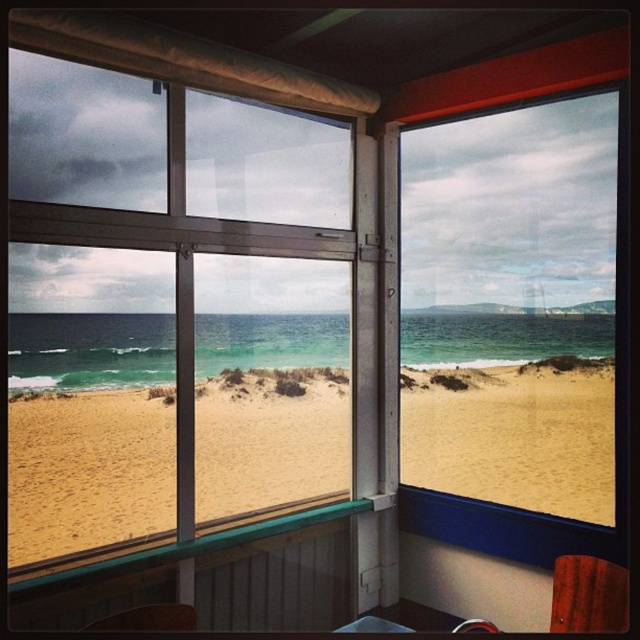
Can you confirm if transparent glass window at center is thinner than wooden chair at lower right?

No, transparent glass window at center is not thinner than wooden chair at lower right.

Describe the element at coordinates (170, 310) in the screenshot. The width and height of the screenshot is (640, 640). I see `transparent glass window at center` at that location.

Between point (129, 232) and point (596, 620), which one is positioned in front?

Point (596, 620) is in front.

The width and height of the screenshot is (640, 640). Identify the location of transparent glass window at center. (170, 310).

Which is behind, point (419, 412) or point (170, 624)?

Positioned behind is point (419, 412).

Who is more distant from viewer, (564, 266) or (148, 621)?

Positioned behind is point (564, 266).

Identify the location of transparent glass window at upper right. This screenshot has height=640, width=640. (512, 307).

Who is shorter, yellow sand at center or wooden chair at lower right?

Standing shorter between the two is wooden chair at lower right.

Which is behind, point (586, 490) or point (618, 570)?

The point (586, 490) is behind.

Find the location of `yellow sand at center`. yellow sand at center is located at coordinates (513, 440).